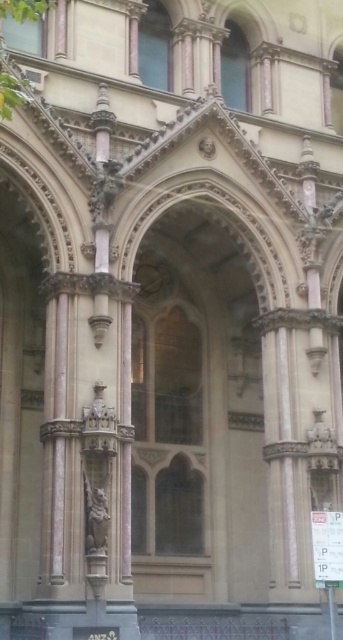
Looking at this image, does beige stone archway at center have a greater height compared to carved stone statue at center?

Yes, beige stone archway at center is taller than carved stone statue at center.

From the picture: Is beige stone archway at center thinner than carved stone statue at center?

No, beige stone archway at center is not thinner than carved stone statue at center.

Is point (136, 468) positioned in front of point (87, 502)?

No.

At what (x,y) coordinates should I click in order to perform the action: click on beige stone archway at center. Please return your answer as a coordinate pair (x, y). The image size is (343, 640). Looking at the image, I should click on (195, 417).